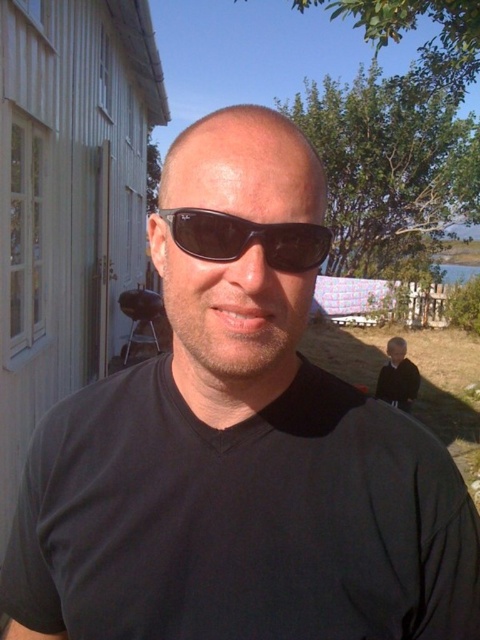
Locate an element on the screen. This screenshot has height=640, width=480. black plastic sunglasses at center is located at coordinates (247, 237).

Who is shorter, black plastic sunglasses at center or black fabric child at lower right?

With less height is black plastic sunglasses at center.

Measure the distance between point (186, 209) and camera.

Point (186, 209) is 46.88 centimeters from camera.

At what (x,y) coordinates should I click in order to perform the action: click on black plastic sunglasses at center. Please return your answer as a coordinate pair (x, y). Image resolution: width=480 pixels, height=640 pixels. Looking at the image, I should click on (247, 237).